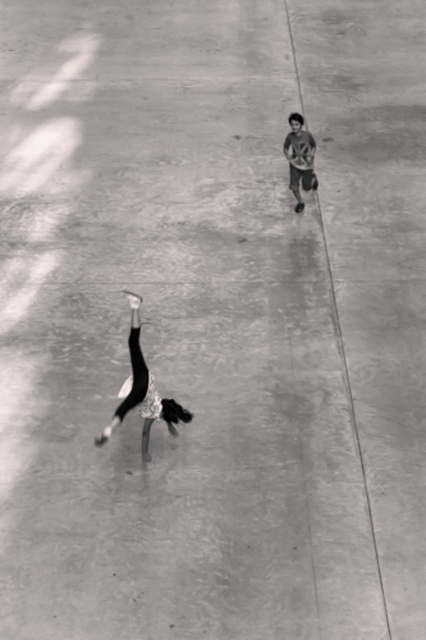
You are a photographer trying to capture a photo where the black fabric child at center and the matte gray shirt at upper right are both visible. Based on their positions, which object is located to the left of the other?

The black fabric child at center is positioned on the left side of matte gray shirt at upper right.

You are a photographer analyzing the image. You need to determine which object takes up more space in the frame. Based on the scene, which is larger between the black fabric child at center and the matte gray shirt at upper right?

The black fabric child at center is bigger than the matte gray shirt at upper right, so the black fabric child at center takes up more space in the frame.

You are observing a black and white photo of two people on a concrete surface. You notice two points marked at coordinates point (137, 300) and point (305, 173). Based on their positions in the image, which point is nearer to you?

Point (137, 300) is closer to the camera than point (305, 173).